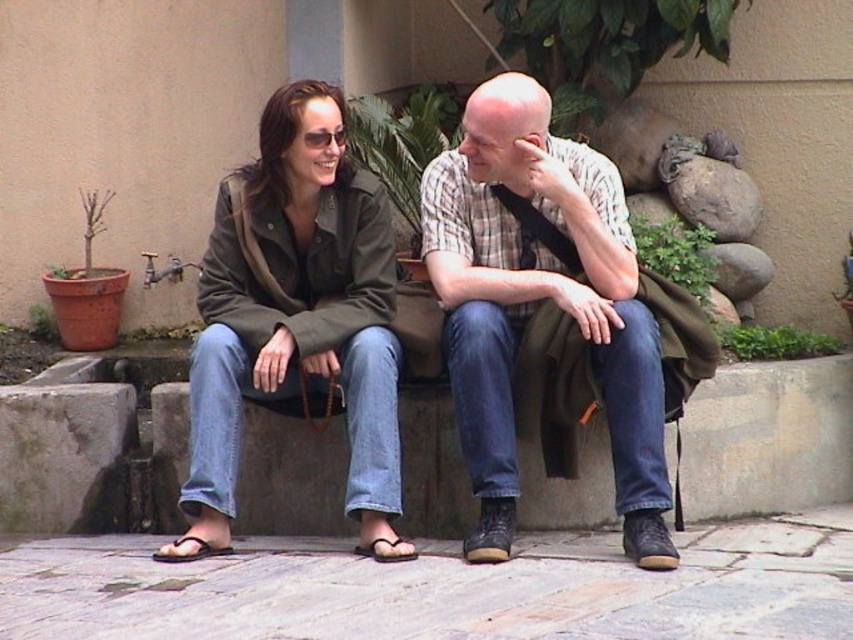
Can you confirm if brown leather sandal at lower center is positioned below purple fabric sandal at lower left?

No, brown leather sandal at lower center is not below purple fabric sandal at lower left.

Between brown leather sandal at lower center and purple fabric sandal at lower left, which one appears on the left side from the viewer's perspective?

purple fabric sandal at lower left

Which is in front, point (399, 548) or point (177, 557)?

Point (177, 557) is more forward.

The height and width of the screenshot is (640, 853). In order to click on brown leather sandal at lower center in this screenshot , I will do `click(386, 548)`.

Can you confirm if matte olive-green jacket at center is positioned above matte plaid shirt at center?

Answer: Correct, matte olive-green jacket at center is located above matte plaid shirt at center.

Is matte olive-green jacket at center smaller than matte plaid shirt at center?

Yes.

This screenshot has width=853, height=640. I want to click on matte olive-green jacket at center, so click(x=296, y=308).

Describe the element at coordinates (538, 301) in the screenshot. This screenshot has width=853, height=640. I see `matte plaid shirt at center` at that location.

The width and height of the screenshot is (853, 640). I want to click on matte plaid shirt at center, so click(x=538, y=301).

At what (x,y) coordinates should I click in order to perform the action: click on matte plaid shirt at center. Please return your answer as a coordinate pair (x, y). Looking at the image, I should click on (538, 301).

Locate an element on the screen. The image size is (853, 640). matte plaid shirt at center is located at coordinates (538, 301).